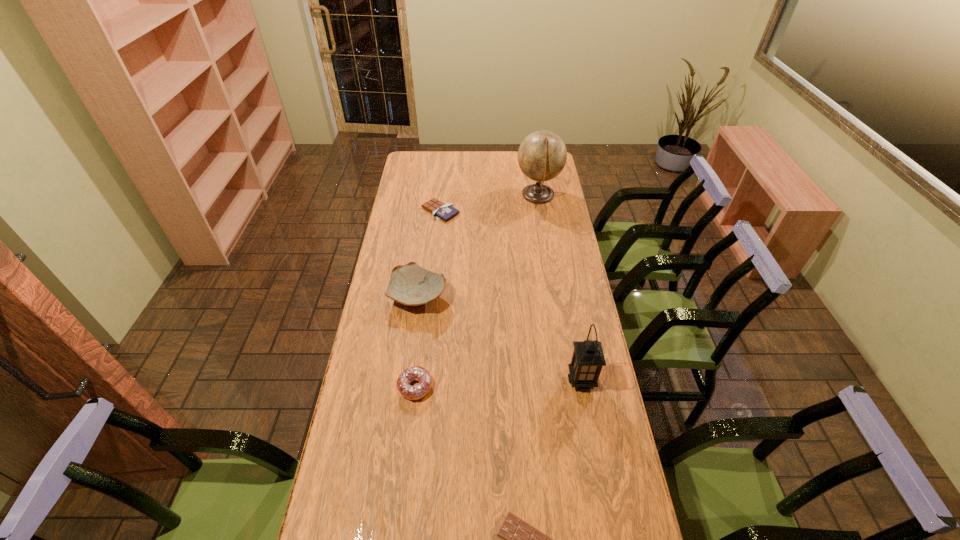
In order to click on vacant area at the left edge in this screenshot , I will do `click(333, 494)`.

Where is `free space at the right edge`? This screenshot has width=960, height=540. free space at the right edge is located at coordinates (609, 476).

In the image, there is a desktop. Where is `vacant space at the far left corner`? The image size is (960, 540). vacant space at the far left corner is located at coordinates (412, 152).

At what (x,y) coordinates should I click in order to perform the action: click on free space between the globe and the pottery. Please return your answer as a coordinate pair (x, y). The width and height of the screenshot is (960, 540). Looking at the image, I should click on (478, 246).

The height and width of the screenshot is (540, 960). Find the location of `vacant region between the tallest object and the left chocolate bar`. vacant region between the tallest object and the left chocolate bar is located at coordinates coord(490,204).

The width and height of the screenshot is (960, 540). What are the coordinates of `unoccupied position between the taller chocolate bar and the pottery` in the screenshot? It's located at (429, 254).

The height and width of the screenshot is (540, 960). I want to click on blank region between the second tallest object and the tallest object, so click(x=560, y=288).

Locate an element on the screen. Image resolution: width=960 pixels, height=540 pixels. vacant area between the third shortest object and the third farthest object is located at coordinates [x=417, y=342].

Identify the location of blank region between the tallest object and the doughnut. The height and width of the screenshot is (540, 960). (476, 291).

At what (x,y) coordinates should I click in order to perform the action: click on object that is the second closest to the fifth shortest object. Please return your answer as a coordinate pair (x, y). Image resolution: width=960 pixels, height=540 pixels. Looking at the image, I should click on (418, 373).